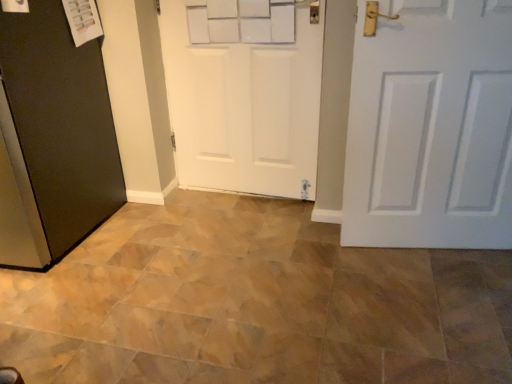
Question: Does white matte door at center, the 2th door positioned from the right, have a lesser width compared to white matte door at center, which is the 3th door from left to right?

Choices:
 (A) no
 (B) yes

Answer: (B)

Question: From a real-world perspective, is white matte door at center, positioned as the second door in left-to-right order, located higher than white matte door at center, the first door positioned from the right?

Choices:
 (A) yes
 (B) no

Answer: (A)

Question: Is white matte door at center, positioned as the second door in left-to-right order, next to white matte door at center, which is the 3th door from left to right?

Choices:
 (A) yes
 (B) no

Answer: (B)

Question: Is the position of white matte door at center, the 2th door positioned from the right, more distant than that of white matte door at center, the first door positioned from the right?

Choices:
 (A) yes
 (B) no

Answer: (A)

Question: Is white matte door at center, positioned as the second door in left-to-right order, looking in the opposite direction of white matte door at center, which is the 3th door from left to right?

Choices:
 (A) yes
 (B) no

Answer: (B)

Question: Is white matte door at center, which is the 3th door from left to right, inside or outside of white matte door at center, positioned as the second door in left-to-right order?

Choices:
 (A) inside
 (B) outside

Answer: (B)

Question: Considering the positions of point (509, 79) and point (233, 163), is point (509, 79) closer or farther from the camera than point (233, 163)?

Choices:
 (A) closer
 (B) farther

Answer: (A)

Question: From a real-world perspective, is white matte door at center, the first door positioned from the right, above or below white matte door at center, positioned as the second door in left-to-right order?

Choices:
 (A) below
 (B) above

Answer: (A)

Question: Based on their sizes in the image, would you say white matte door at center, which is the 3th door from left to right, is bigger or smaller than white matte door at center, the 2th door positioned from the right?

Choices:
 (A) big
 (B) small

Answer: (A)

Question: Does point (23, 61) appear closer or farther from the camera than point (274, 122)?

Choices:
 (A) closer
 (B) farther

Answer: (A)

Question: Is black matte door at left, placed as the first door when sorted from left to right, taller or shorter than white matte door at center, positioned as the second door in left-to-right order?

Choices:
 (A) tall
 (B) short

Answer: (A)

Question: Considering their positions, is black matte door at left, which appears as the 3th door when viewed from the right, located in front of or behind white matte door at center, positioned as the second door in left-to-right order?

Choices:
 (A) front
 (B) behind

Answer: (A)

Question: Would you say black matte door at left, which appears as the 3th door when viewed from the right, is inside or outside white matte door at center, positioned as the second door in left-to-right order?

Choices:
 (A) inside
 (B) outside

Answer: (B)

Question: Is black matte door at left, placed as the first door when sorted from left to right, taller or shorter than white matte door at center, which is the 3th door from left to right?

Choices:
 (A) tall
 (B) short

Answer: (A)

Question: From the image's perspective, relative to white matte door at center, which is the 3th door from left to right, is black matte door at left, which appears as the 3th door when viewed from the right, above or below?

Choices:
 (A) below
 (B) above

Answer: (B)